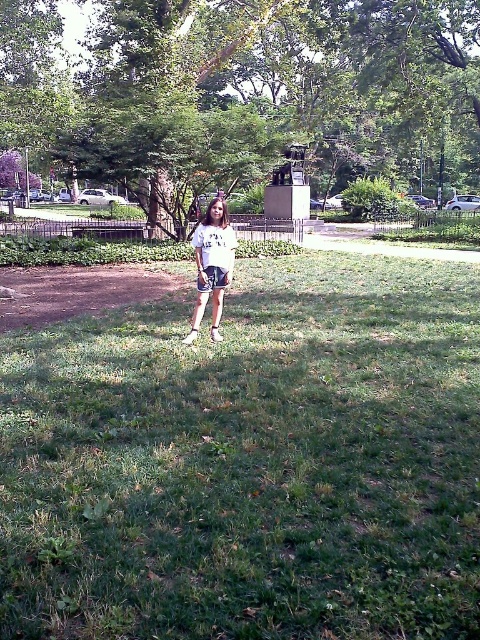
Consider the image. You are a photographer trying to capture the entire scene of the green grassy field at center and the white cotton shirt at center. Which object should you focus on first if you want to ensure both are in frame?

The green grassy field at center has a smaller size compared to the white cotton shirt at center, so you should focus on the white cotton shirt at center first to ensure both fit within the frame.

You are a photographer trying to capture a clear shot of the person standing in the green grassy field at center. Since the white cotton shirt at center is part of the scene, will the shirt be taller than the grass around it?

The green grassy field at center is not as tall as the white cotton shirt at center, so yes, the shirt will be taller than the grass around it.